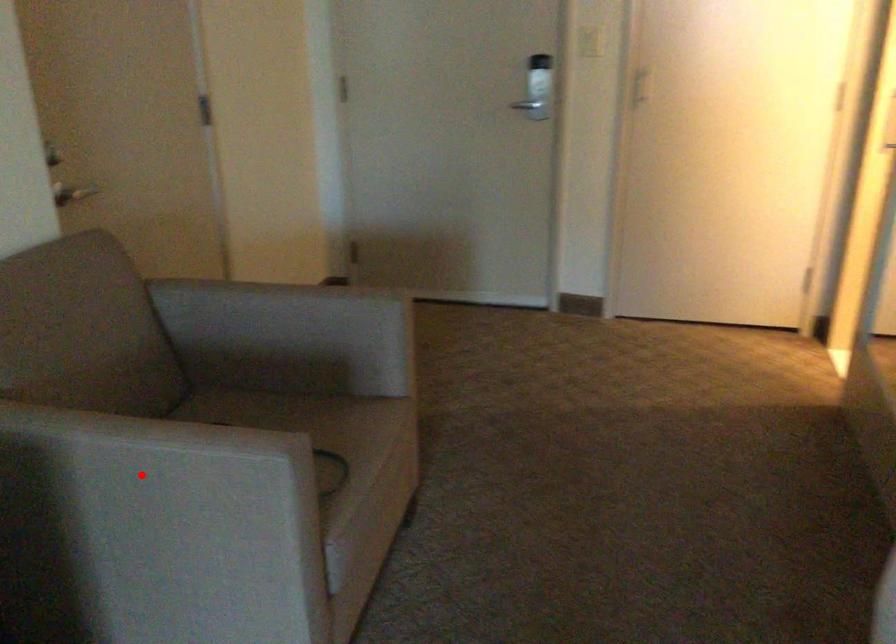
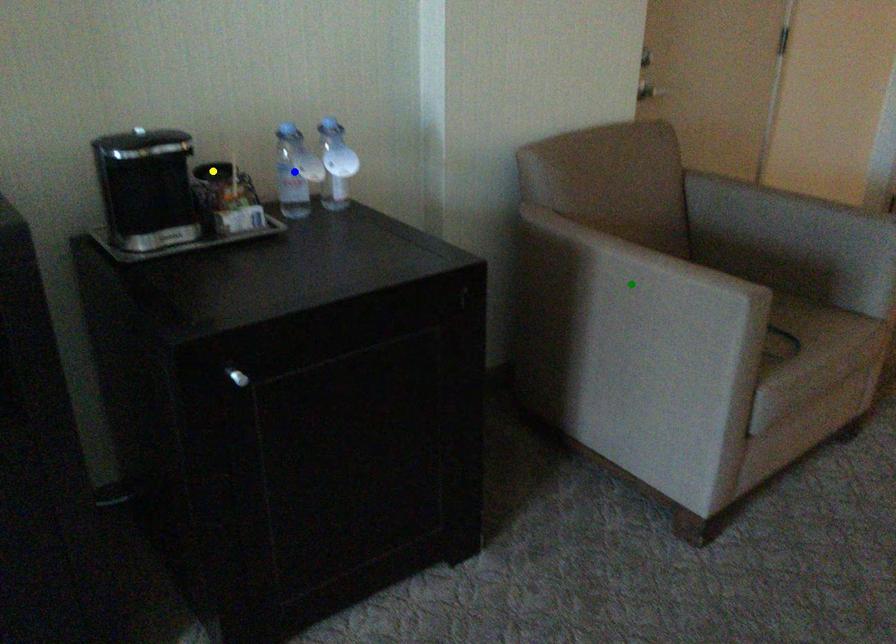
Question: I am providing you with two images of the same scene from different viewpoints. A red point is marked on the first image. You are given multiple points on the second image. Which point in image 2 represents the same 3d spot as the red point in image 1?

Choices:
 (A) blue point
 (B) green point
 (C) yellow point

Answer: (B)